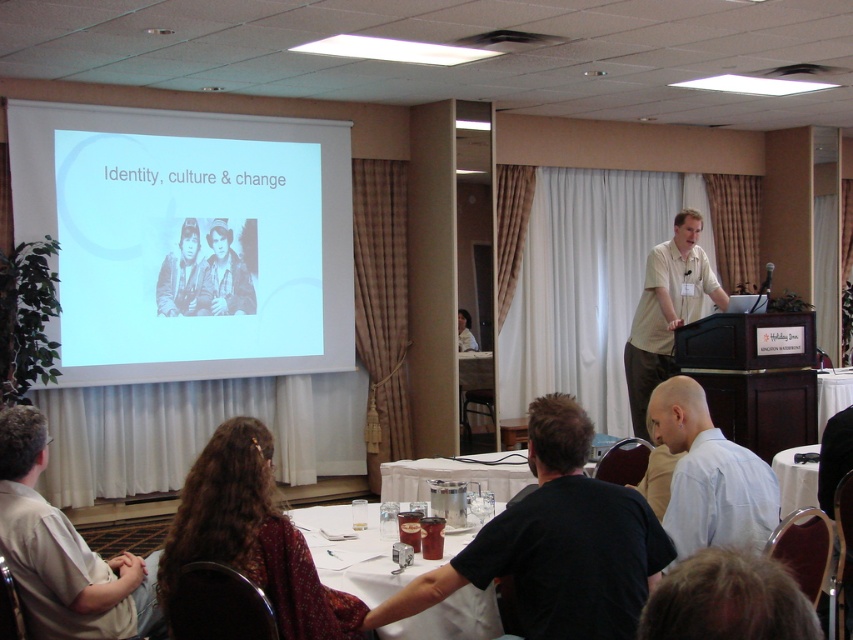
Who is higher up, white matte projection screen at upper left or white glossy table at lower center?

white matte projection screen at upper left is higher up.

Is white matte projection screen at upper left positioned before white glossy table at lower center?

No, it is behind white glossy table at lower center.

Locate an element on the screen. The height and width of the screenshot is (640, 853). white matte projection screen at upper left is located at coordinates click(189, 240).

Where is `white matte projection screen at upper left`? This screenshot has height=640, width=853. white matte projection screen at upper left is located at coordinates (189, 240).

Can you confirm if leather jacket at center is positioned to the left of grayscale photo of two people at center?

Incorrect, leather jacket at center is not on the left side of grayscale photo of two people at center.

Can you confirm if leather jacket at center is thinner than grayscale photo of two people at center?

No, leather jacket at center is not thinner than grayscale photo of two people at center.

At what (x,y) coordinates should I click in order to perform the action: click on leather jacket at center. Please return your answer as a coordinate pair (x, y). This screenshot has height=640, width=853. Looking at the image, I should click on (224, 276).

Which is above, dark brown hair at lower left or light blue shirt at lower right?

Positioned higher is light blue shirt at lower right.

The height and width of the screenshot is (640, 853). I want to click on dark brown hair at lower left, so click(252, 536).

I want to click on dark brown hair at lower left, so click(x=252, y=536).